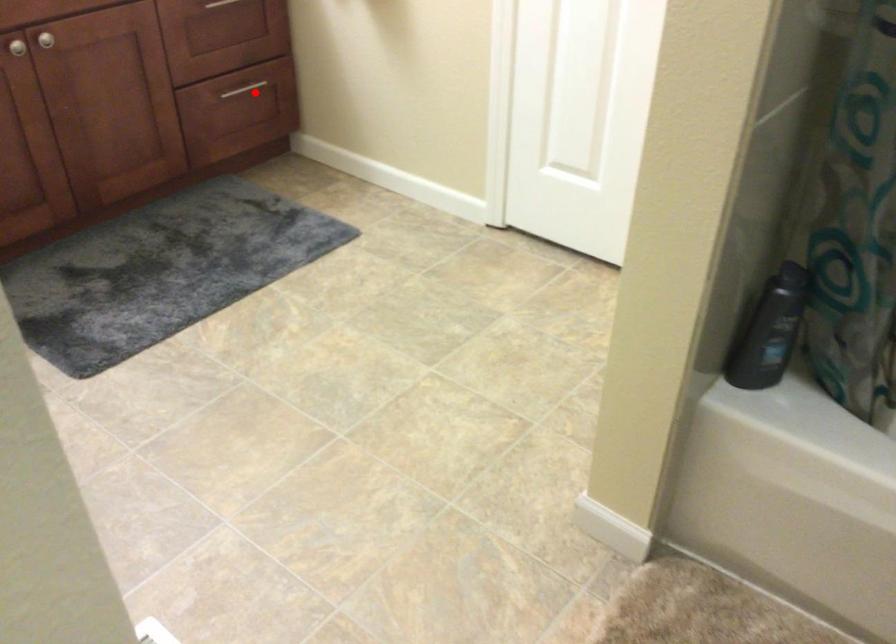
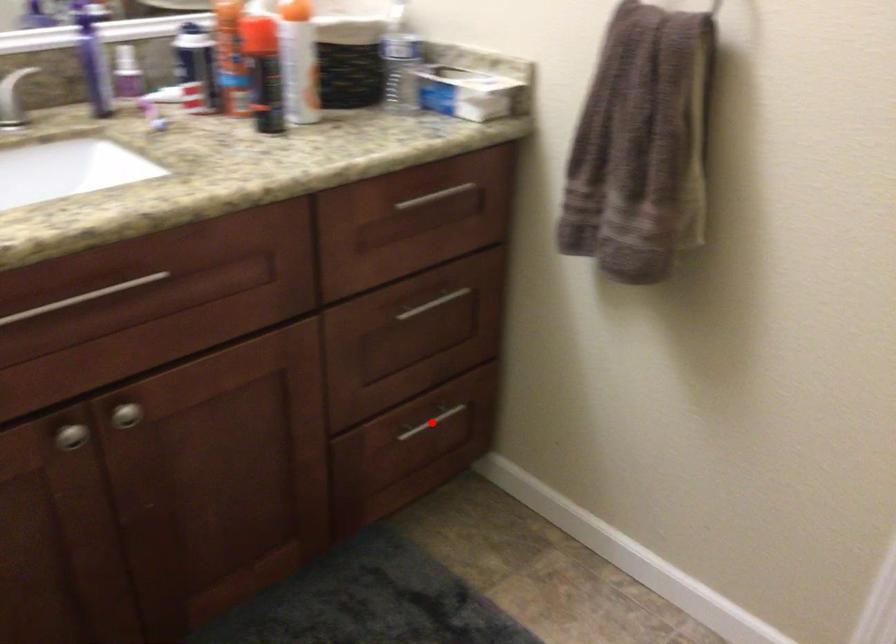
I am providing you with two images of the same scene from different viewpoints. A red point is marked on the first image and another point is marked on the second image. Is the red point in image1 aligned with the point shown in image2?

Yes